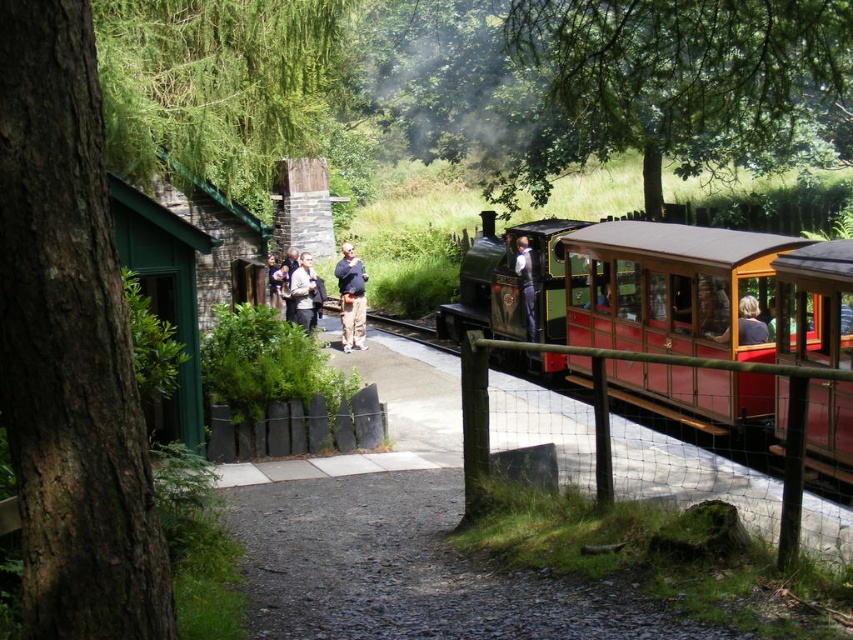
Between dark blue jeans at center and matte brown hair at right, which one appears on the left side from the viewer's perspective?

From the viewer's perspective, dark blue jeans at center appears more on the left side.

Is dark blue jeans at center positioned before matte brown hair at right?

No, it is not.

Find the location of a particular element. The image size is (853, 640). dark blue jeans at center is located at coordinates (351, 298).

This screenshot has height=640, width=853. In order to click on dark blue jeans at center in this screenshot , I will do `click(351, 298)`.

Is green polished wood train at center below light brown leather jacket at center?

Yes, green polished wood train at center is below light brown leather jacket at center.

Is green polished wood train at center positioned before light brown leather jacket at center?

That is True.

Is point (483, 253) less distant than point (289, 294)?

Yes, point (483, 253) is in front of point (289, 294).

Find the location of a particular element. Image resolution: width=853 pixels, height=640 pixels. green polished wood train at center is located at coordinates (621, 285).

Is light brown leather jacket at center further to camera compared to light blue shirt at center?

Yes, light brown leather jacket at center is behind light blue shirt at center.

Who is more distant from viewer, (305, 301) or (534, 316)?

Point (305, 301)

Where is `light brown leather jacket at center`? light brown leather jacket at center is located at coordinates (302, 291).